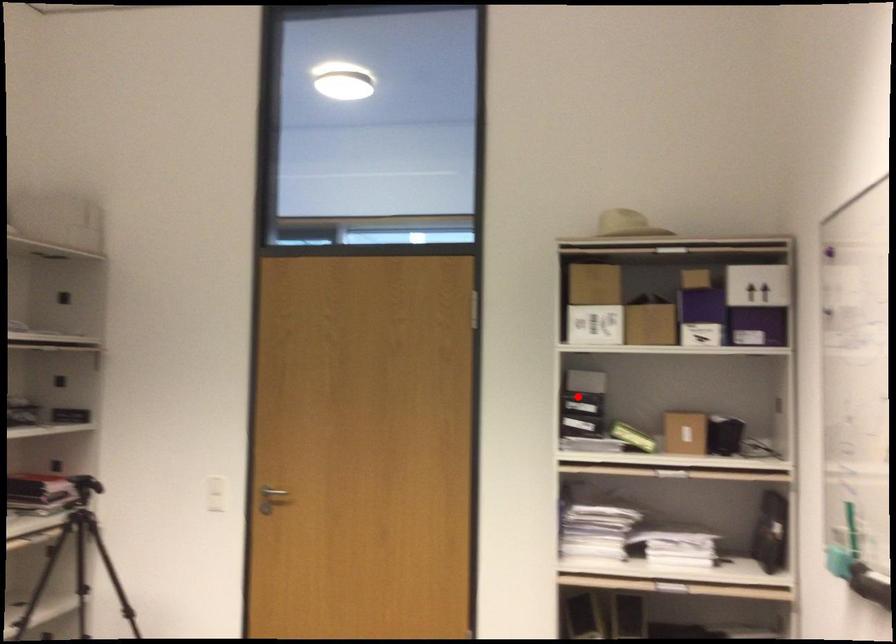
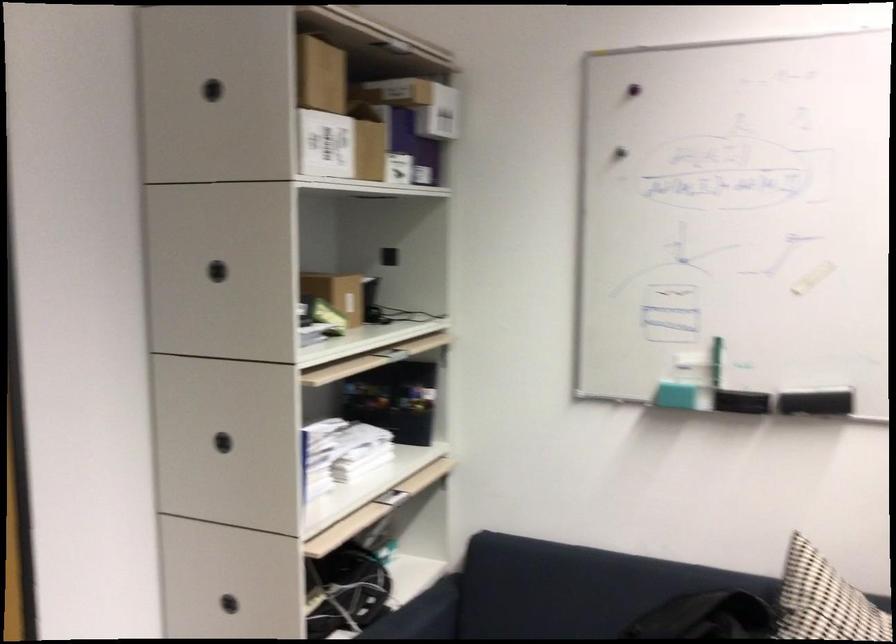
In the second image, find the point that corresponds to the highlighted location in the first image.

(217, 270)